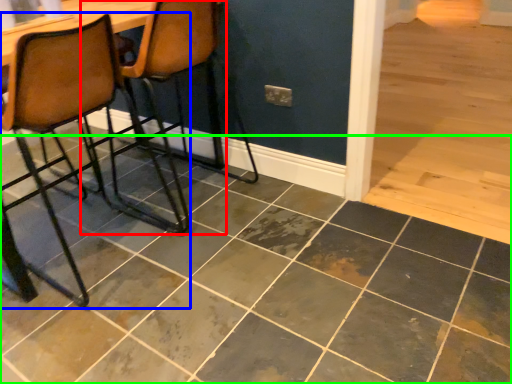
Question: Which object is the farthest from chair (highlighted by a red box)? Choose among these: chair (highlighted by a blue box) or ceramic tile (highlighted by a green box).

Choices:
 (A) chair
 (B) ceramic tile

Answer: (B)